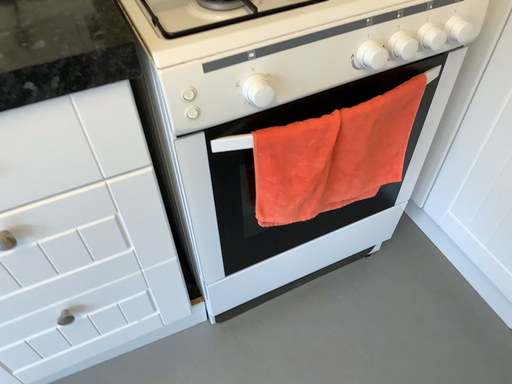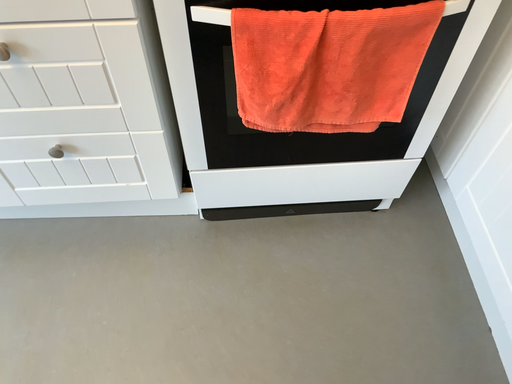
Question: Which way did the camera rotate in the video?

Choices:
 (A) rotated left
 (B) rotated right

Answer: (A)